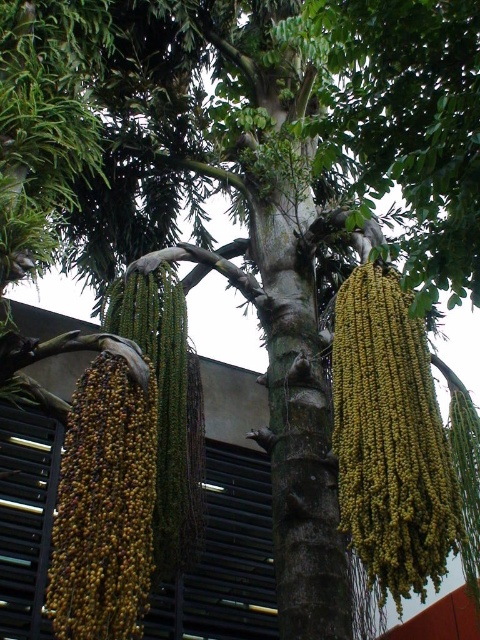
Question: Can you confirm if yellow-green textured cluster at right is positioned below green matte palm fruit at left?

Choices:
 (A) yes
 (B) no

Answer: (B)

Question: Does yellow-green textured cluster at right have a smaller size compared to green matte palm fruit at left?

Choices:
 (A) no
 (B) yes

Answer: (A)

Question: Among these points, which one is farthest from the camera?

Choices:
 (A) (141, 554)
 (B) (360, 346)

Answer: (B)

Question: Is yellow-green textured cluster at right to the left of green matte palm fruit at left from the viewer's perspective?

Choices:
 (A) no
 (B) yes

Answer: (A)